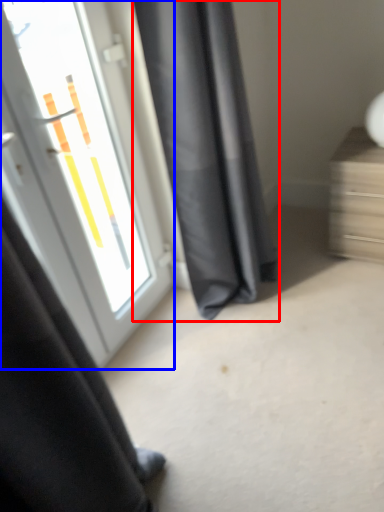
Question: Which point is further to the camera, curtain (highlighted by a red box) or door (highlighted by a blue box)?

Choices:
 (A) curtain
 (B) door

Answer: (A)